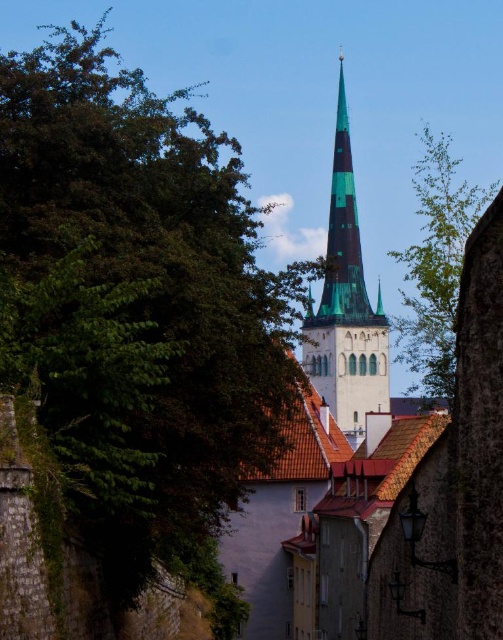
Based on the photo, which of these two, green glass spire at center or green leafy tree at upper right, stands taller?

green glass spire at center is taller.

Can you confirm if green glass spire at center is positioned to the left of green leafy tree at upper right?

Indeed, green glass spire at center is positioned on the left side of green leafy tree at upper right.

Is point (356, 403) positioned after point (426, 349)?

No, it is not.

Locate an element on the screen. The height and width of the screenshot is (640, 503). green glass spire at center is located at coordinates (347, 307).